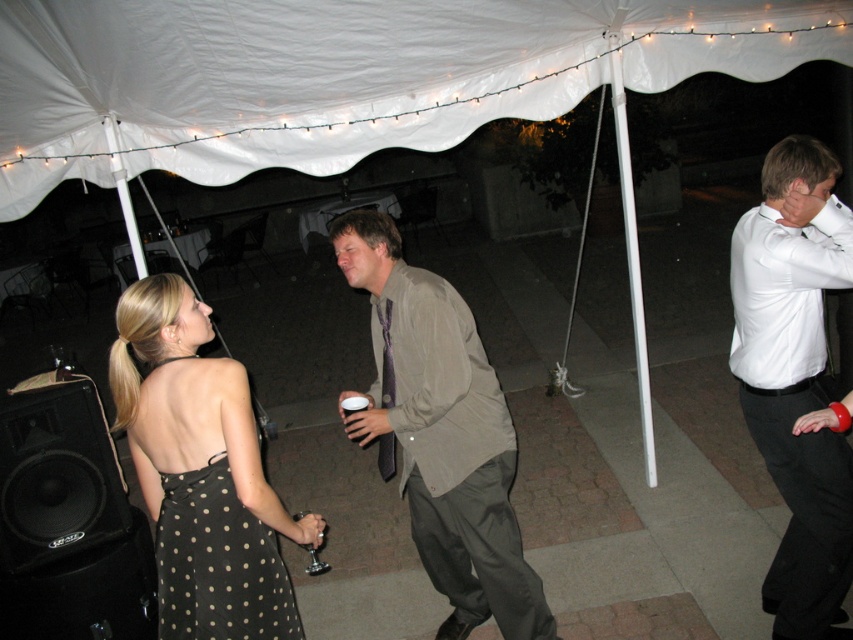
Is matte khaki shirt at center above black polka dot fabric dress at lower left?

Yes, matte khaki shirt at center is above black polka dot fabric dress at lower left.

Can you confirm if matte khaki shirt at center is positioned to the left of black polka dot fabric dress at lower left?

Incorrect, matte khaki shirt at center is not on the left side of black polka dot fabric dress at lower left.

Find the location of a particular element. This screenshot has height=640, width=853. matte khaki shirt at center is located at coordinates (440, 433).

Can you confirm if matte khaki shirt at center is positioned below white glossy shirt at upper right?

Indeed, matte khaki shirt at center is positioned under white glossy shirt at upper right.

Is point (456, 321) positioned after point (827, 152)?

Yes, it is.

Identify the location of matte khaki shirt at center. coord(440,433).

Does point (192, 298) come in front of point (358, 396)?

That is True.

Is black satin dress at center shorter than white paper cup at center?

No, black satin dress at center is not shorter than white paper cup at center.

What do you see at coordinates (201, 472) in the screenshot? This screenshot has height=640, width=853. I see `black satin dress at center` at bounding box center [201, 472].

Identify the location of black satin dress at center. This screenshot has height=640, width=853. (201, 472).